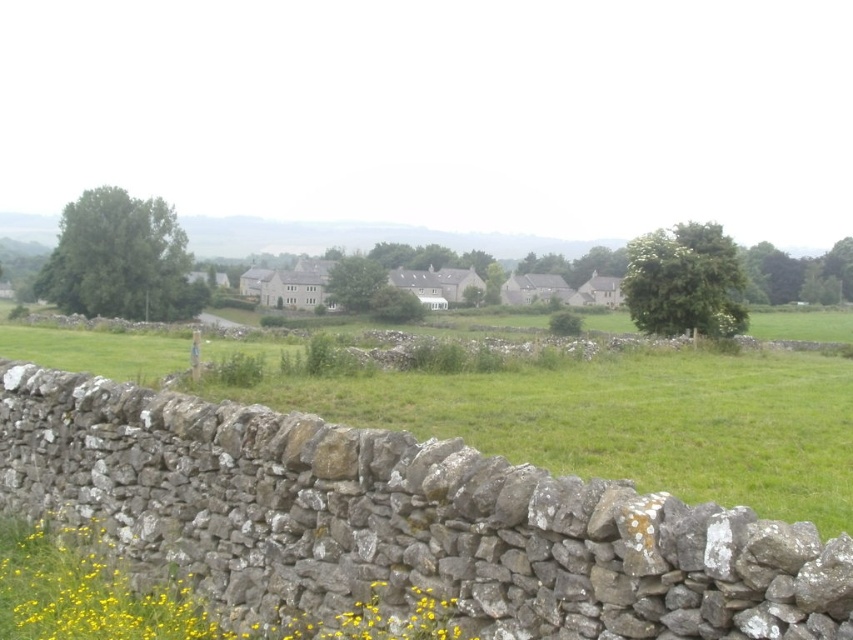
What is located at the point with coordinates (618, 419) in the image?

The green grassy field at center is located at point (618, 419).

You are standing in front of the stone wall and want to walk towards the green grassy field at center and the yellow grass at lower left. Which direction should you walk to reach the wider area first?

The green grassy field at center has a larger width than the yellow grass at lower left, so you should walk towards the green grassy field at center to reach the wider area first.

You are standing in front of the stone wall and want to walk towards the yellow grass at lower left. Which direction should you walk relative to the green grassy field at center?

The yellow grass at lower left is behind the green grassy field at center. To reach it, you should walk towards the lower left direction, behind the green grassy field at center.